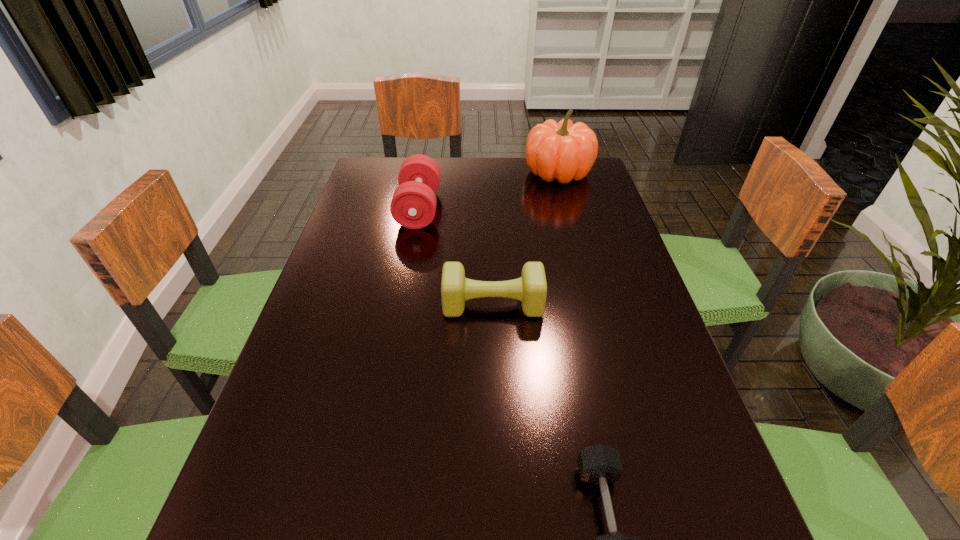
Locate an element on the screen. The width and height of the screenshot is (960, 540). the tallest object is located at coordinates (563, 151).

At what (x,y) coordinates should I click in order to perform the action: click on the second tallest object. Please return your answer as a coordinate pair (x, y). Looking at the image, I should click on click(x=413, y=205).

Find the location of a particular element. the tallest dumbbell is located at coordinates coord(413,205).

Locate an element on the screen. This screenshot has height=540, width=960. the second tallest dumbbell is located at coordinates (531, 288).

This screenshot has width=960, height=540. Find the location of `the second object from left to right`. the second object from left to right is located at coordinates (531, 288).

Identify the location of vacant space situated on the left of the tallest object. point(436,173).

Where is `blank area located 0.320m on the front of the farthest dumbbell`? The height and width of the screenshot is (540, 960). blank area located 0.320m on the front of the farthest dumbbell is located at coordinates (398, 320).

Locate an element on the screen. The height and width of the screenshot is (540, 960). vacant region located 0.090m on the left of the second dumbbell from right to left is located at coordinates (403, 305).

Locate an element on the screen. The height and width of the screenshot is (540, 960). pumpkin situated at the far edge is located at coordinates (563, 151).

This screenshot has width=960, height=540. I want to click on dumbbell at the far edge, so click(413, 205).